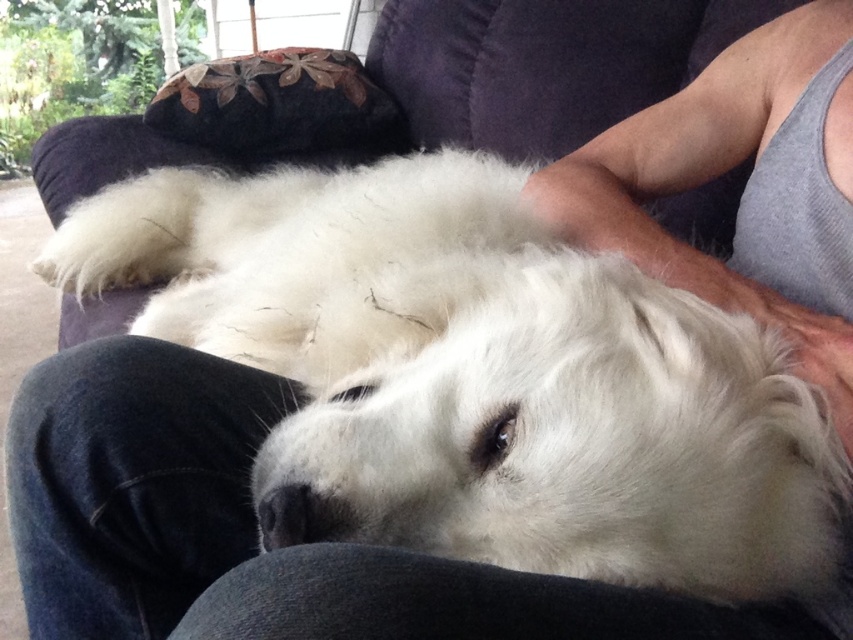
Who is lower down, white fluffy dog at center or gray tank top at upper right?

white fluffy dog at center is below.

Can you confirm if white fluffy dog at center is smaller than gray tank top at upper right?

Actually, white fluffy dog at center might be larger than gray tank top at upper right.

Is point (548, 392) farther from viewer compared to point (624, 180)?

No, it is in front of (624, 180).

The image size is (853, 640). What are the coordinates of `white fluffy dog at center` in the screenshot? It's located at (477, 376).